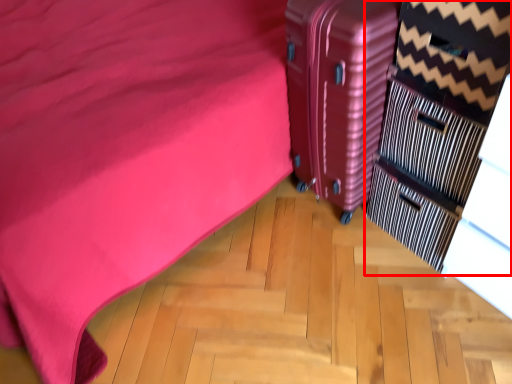
Question: From the image's perspective, what is the correct spatial positioning of dresser (annotated by the red box) in reference to suitcase?

Choices:
 (A) below
 (B) above

Answer: (A)